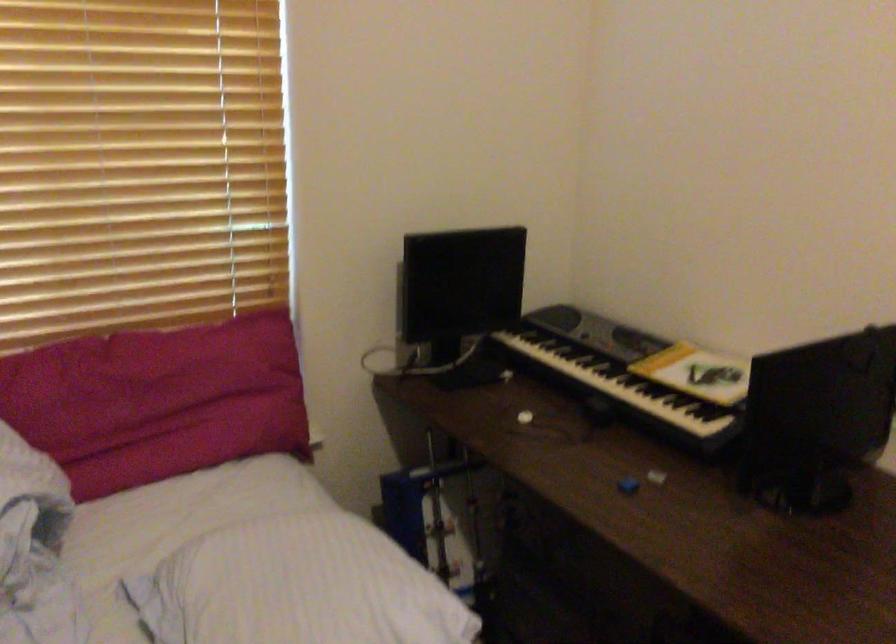
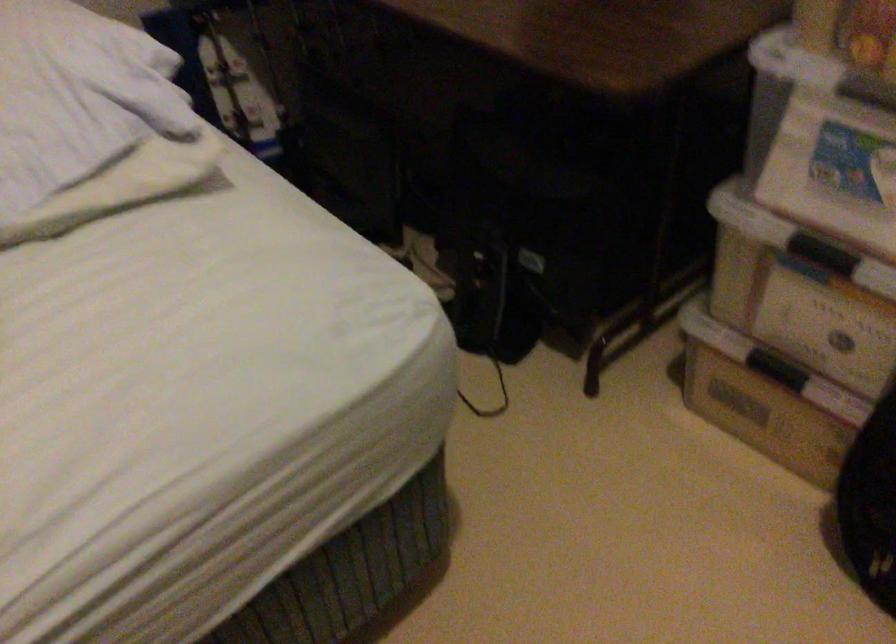
The images are taken continuously from a first-person perspective. In which direction are you moving?

The cameraman moved toward right, forward.